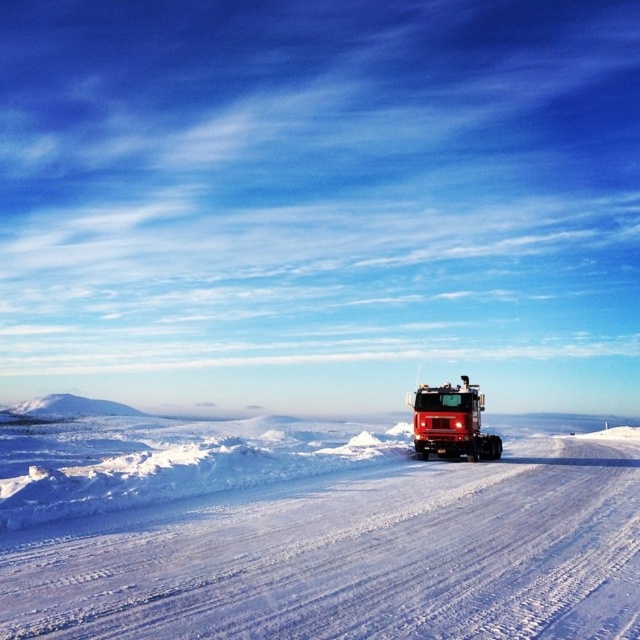
You are standing at the starting point of the snow road and want to reach the red truck driving away from you. Which direction should you move relative to the white powdery snow at center?

The white powdery snow at center is located at point (356, 552), so you should move towards the direction of the white powdery snow at center to reach the red truck driving away from you since it is positioned near the center right of the frame.

You are standing at the point with coordinates [356,552] in the winter landscape. What material are you standing on?

The point at [356,552] corresponds to white powdery snow at center.